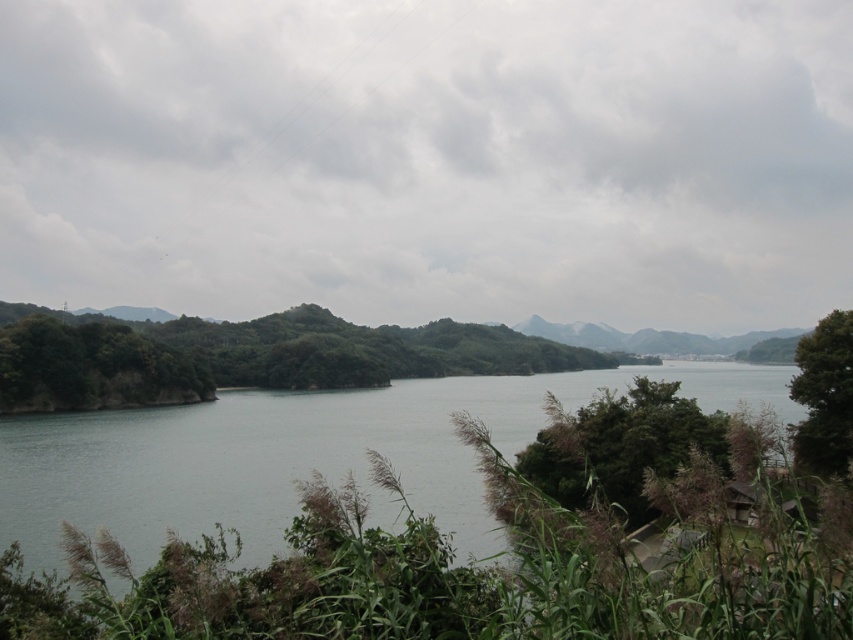
You are standing in the landscape scene and want to walk from the green leafy shrubs at left to the green leafy tree at right. Which direction should you move to get closer to the tree?

To get closer to the green leafy tree at right, you should move away from the green leafy shrubs at left since the shrubs are closer to you than the tree.

In the scene shown: You are an environmental scientist assessing the landscape. You need to determine which area is larger in size between the gray water at center and the green leafy shrubs at left. Based on the scene, which one is larger?

The green leafy shrubs at left are larger than the gray water at center according to the description.

You are standing in the foreground of the landscape and want to walk to the gray water at center. Which direction should you head relative to the green leafy shrubs at left?

You should head to the right of the green leafy shrubs at left to reach the gray water at center since the gray water at center is located to the right of the green leafy shrubs at left.